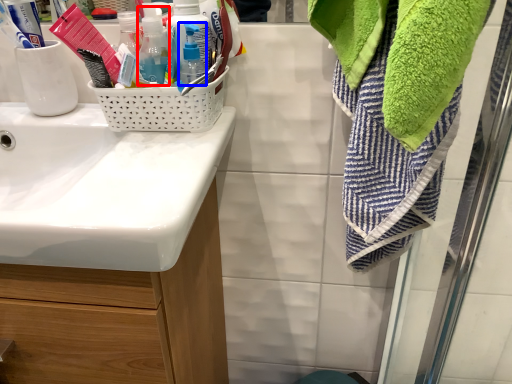
Question: Which of the following is the farthest to the observer, bottle (highlighted by a red box) or bottle (highlighted by a blue box)?

Choices:
 (A) bottle
 (B) bottle

Answer: (B)